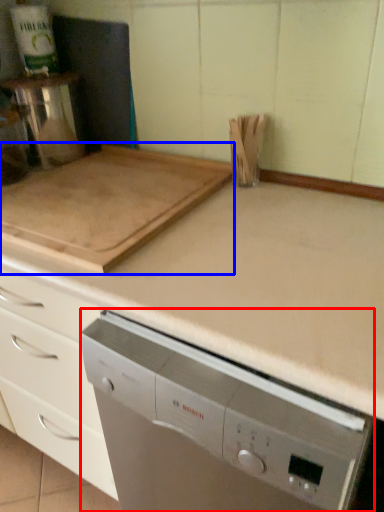
Question: Among these objects, which one is nearest to the camera, home appliance (highlighted by a red box) or kitchen appliance (highlighted by a blue box)?

Choices:
 (A) home appliance
 (B) kitchen appliance

Answer: (A)